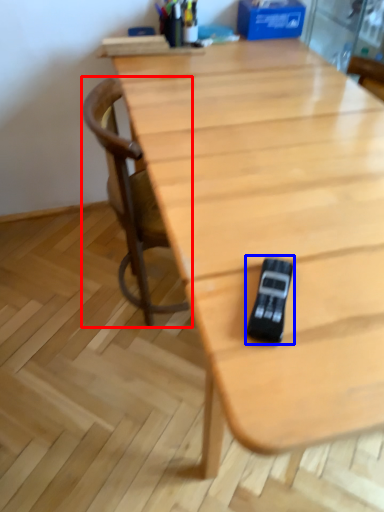
Question: Which point is further to the camera, chair (highlighted by a red box) or game controller (highlighted by a blue box)?

Choices:
 (A) chair
 (B) game controller

Answer: (A)